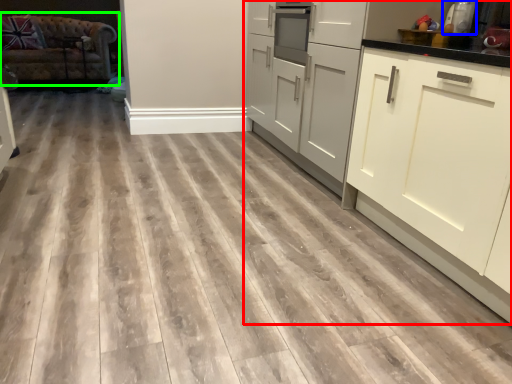
Question: Which object is positioned farthest from cabinetry (highlighted by a red box)? Select from appliance (highlighted by a blue box) and studio couch (highlighted by a green box).

Choices:
 (A) appliance
 (B) studio couch

Answer: (B)